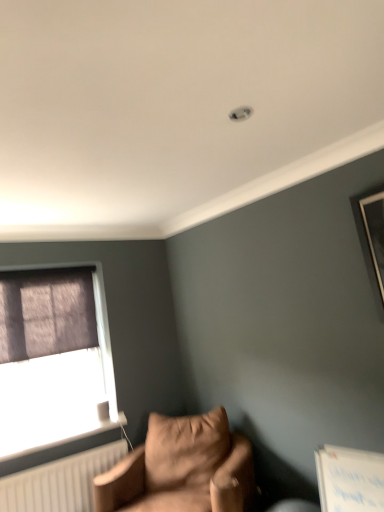
Question: Is white plastic radiator at lower left oriented towards matte purple curtain at left?

Choices:
 (A) no
 (B) yes

Answer: (A)

Question: From the image's perspective, is white plastic radiator at lower left below matte purple curtain at left?

Choices:
 (A) no
 (B) yes

Answer: (B)

Question: Is white plastic radiator at lower left taller than matte purple curtain at left?

Choices:
 (A) no
 (B) yes

Answer: (A)

Question: Would you consider white plastic radiator at lower left to be distant from matte purple curtain at left?

Choices:
 (A) yes
 (B) no

Answer: (B)

Question: Can you confirm if white plastic radiator at lower left is shorter than matte purple curtain at left?

Choices:
 (A) no
 (B) yes

Answer: (B)

Question: Choose the correct answer: Is suede-like brown armchair at lower left inside matte purple curtain at left or outside it?

Choices:
 (A) outside
 (B) inside

Answer: (A)

Question: Is suede-like brown armchair at lower left taller or shorter than matte purple curtain at left?

Choices:
 (A) short
 (B) tall

Answer: (A)

Question: Considering the relative positions of suede-like brown armchair at lower left and matte purple curtain at left in the image provided, is suede-like brown armchair at lower left to the left or to the right of matte purple curtain at left?

Choices:
 (A) left
 (B) right

Answer: (B)

Question: Is suede-like brown armchair at lower left wider or thinner than matte purple curtain at left?

Choices:
 (A) thin
 (B) wide

Answer: (B)

Question: Does point (16, 367) appear closer or farther from the camera than point (51, 442)?

Choices:
 (A) farther
 (B) closer

Answer: (A)

Question: From the image's perspective, is matte purple curtain at left positioned above or below white plastic radiator at lower left?

Choices:
 (A) below
 (B) above

Answer: (B)

Question: In terms of width, does matte purple curtain at left look wider or thinner when compared to white plastic radiator at lower left?

Choices:
 (A) thin
 (B) wide

Answer: (A)

Question: Considering the relative positions of matte purple curtain at left and white plastic radiator at lower left in the image provided, is matte purple curtain at left to the left or to the right of white plastic radiator at lower left?

Choices:
 (A) left
 (B) right

Answer: (A)

Question: Based on their positions, is white plastic radiator at lower left located to the left or right of suede-like brown armchair at lower left?

Choices:
 (A) right
 (B) left

Answer: (B)

Question: Choose the correct answer: Is white plastic radiator at lower left inside suede-like brown armchair at lower left or outside it?

Choices:
 (A) outside
 (B) inside

Answer: (A)